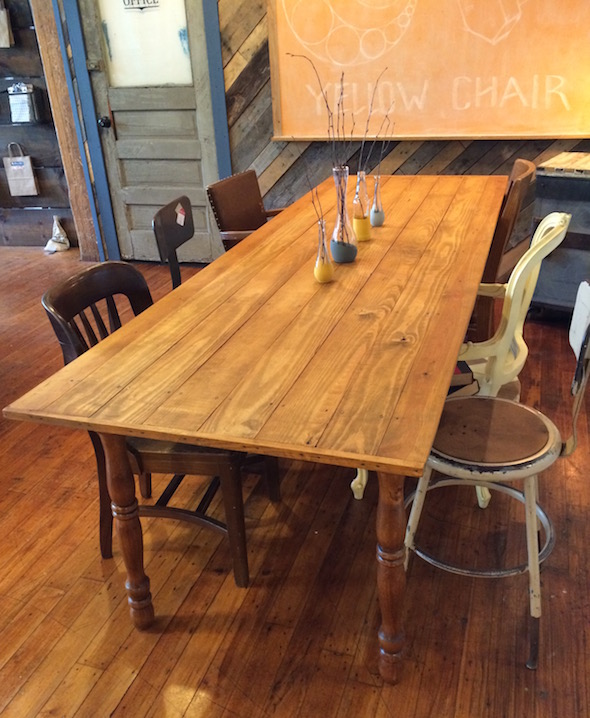
I want to click on 2 blue sand center pieces, so click(348, 256), click(376, 215).